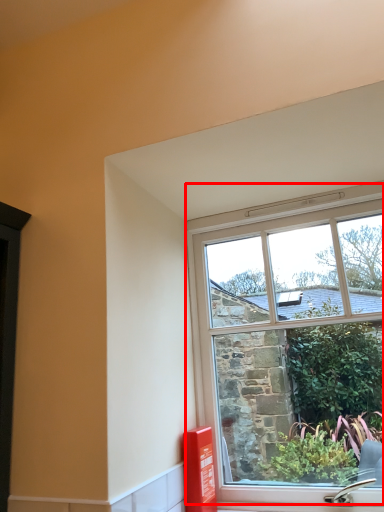
Question: Considering the relative positions of window (annotated by the red box) and window box in the image provided, where is window (annotated by the red box) located with respect to the staircase?

Choices:
 (A) right
 (B) left

Answer: (A)